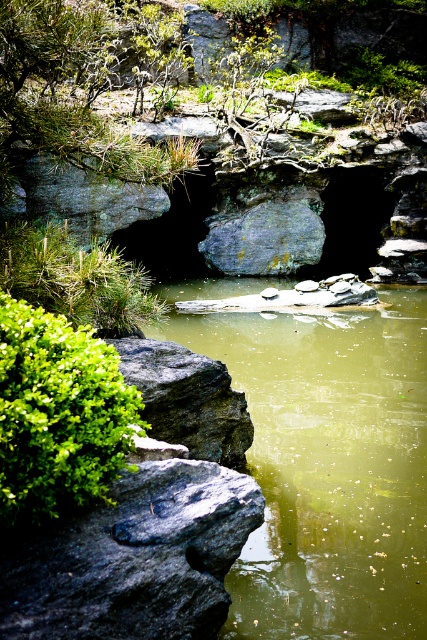
Between green matte pine tree at left and dark gray rock at center, which one has less height?

With less height is green matte pine tree at left.

Is green matte pine tree at left behind dark gray rock at center?

No, green matte pine tree at left is in front of dark gray rock at center.

Does point (75, 250) come in front of point (139, 369)?

No, it is behind (139, 369).

Find the location of a particular element. green matte pine tree at left is located at coordinates (75, 278).

Is green leafy bush at lower left shorter than dark gray rock at center?

Indeed, green leafy bush at lower left has a lesser height compared to dark gray rock at center.

What do you see at coordinates (58, 413) in the screenshot?
I see `green leafy bush at lower left` at bounding box center [58, 413].

This screenshot has height=640, width=427. I want to click on green leafy bush at lower left, so click(x=58, y=413).

Find the location of a particular element. black rough rock at lower left is located at coordinates (134, 557).

Can you confirm if black rough rock at lower left is taller than dark gray rock at center?

Incorrect, black rough rock at lower left's height is not larger of dark gray rock at center's.

Where is `black rough rock at lower left`? The height and width of the screenshot is (640, 427). black rough rock at lower left is located at coordinates (134, 557).